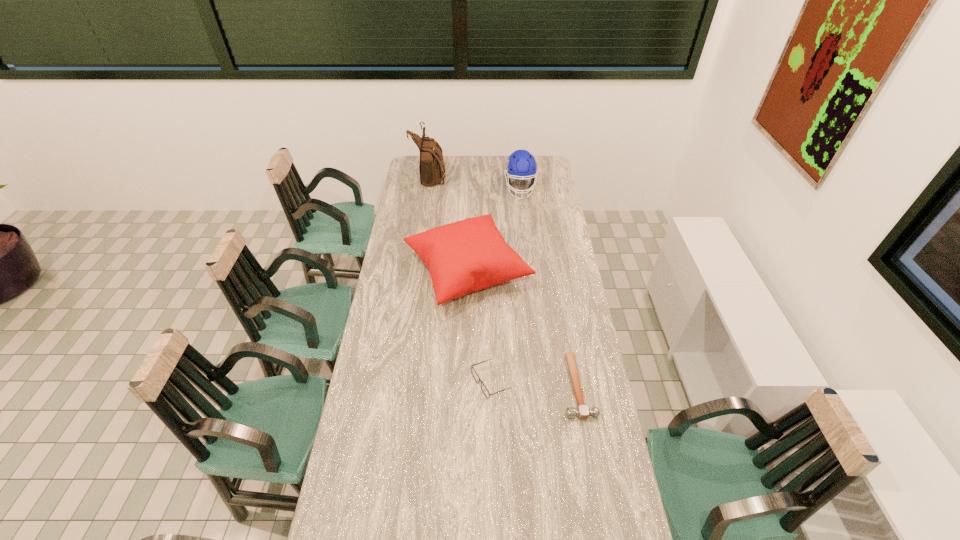
This screenshot has height=540, width=960. Identify the location of blank space located with the lenses facing outward on the second shortest object. point(414,382).

Identify the location of vacant region located on the front of the hammer. (603, 529).

This screenshot has width=960, height=540. I want to click on shoulder bag that is at the far edge, so click(431, 166).

Where is `football helmet present at the far edge`? This screenshot has height=540, width=960. football helmet present at the far edge is located at coordinates (520, 164).

Find the location of a particular element. The image size is (960, 540). shoulder bag that is at the left edge is located at coordinates click(x=431, y=166).

You are a GUI agent. You are given a task and a screenshot of the screen. Output one action in this format:
    pyautogui.click(x=<x>, y=<y>)
    Task: Click on the cushion that is at the left edge
    The height and width of the screenshot is (540, 960).
    Given the screenshot: What is the action you would take?
    pyautogui.click(x=466, y=256)

The width and height of the screenshot is (960, 540). I want to click on football helmet located in the right edge section of the desktop, so click(520, 164).

Image resolution: width=960 pixels, height=540 pixels. Find the location of `hammer that is positioned at the right edge`. hammer that is positioned at the right edge is located at coordinates pos(582,412).

Locate an element on the screen. object located in the far left corner section of the desktop is located at coordinates (431, 166).

Locate an element on the screen. The image size is (960, 540). object at the far right corner is located at coordinates click(520, 164).